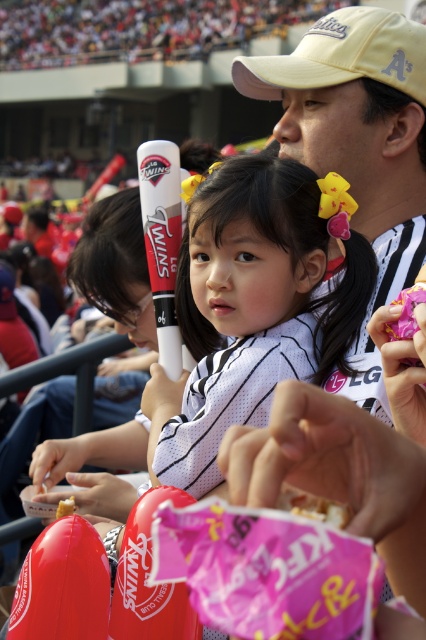
Does matte white cap at upper right appear on the left side of yellow fabric baseball cap at upper center?

Yes, matte white cap at upper right is to the left of yellow fabric baseball cap at upper center.

Does matte white cap at upper right lie behind yellow fabric baseball cap at upper center?

No.

Describe the element at coordinates (359, 147) in the screenshot. I see `matte white cap at upper right` at that location.

At what (x,y) coordinates should I click in order to perform the action: click on matte white cap at upper right. Please return your answer as a coordinate pair (x, y). Looking at the image, I should click on (359, 147).

Is the position of yellow fabric baseball cap at upper center more distant than that of yellow sponge cake at center?

Yes, it is behind yellow sponge cake at center.

Is yellow fabric baseball cap at upper center in front of yellow sponge cake at center?

No.

I want to click on yellow fabric baseball cap at upper center, so click(x=342, y=54).

Is point (204, 292) positioned behind point (319, 81)?

No, (204, 292) is in front of (319, 81).

Does white matte baseball bat at center appear on the right side of yellow fabric baseball cap at upper center?

No, white matte baseball bat at center is not to the right of yellow fabric baseball cap at upper center.

Which is behind, point (328, 288) or point (368, 42)?

Point (368, 42)

Locate an element on the screen. The image size is (426, 640). white matte baseball bat at center is located at coordinates (239, 321).